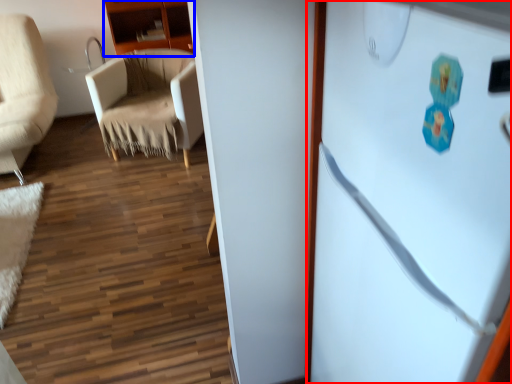
Question: Which object is further to the camera taking this photo, refrigerator (highlighted by a red box) or cabinetry (highlighted by a blue box)?

Choices:
 (A) refrigerator
 (B) cabinetry

Answer: (B)